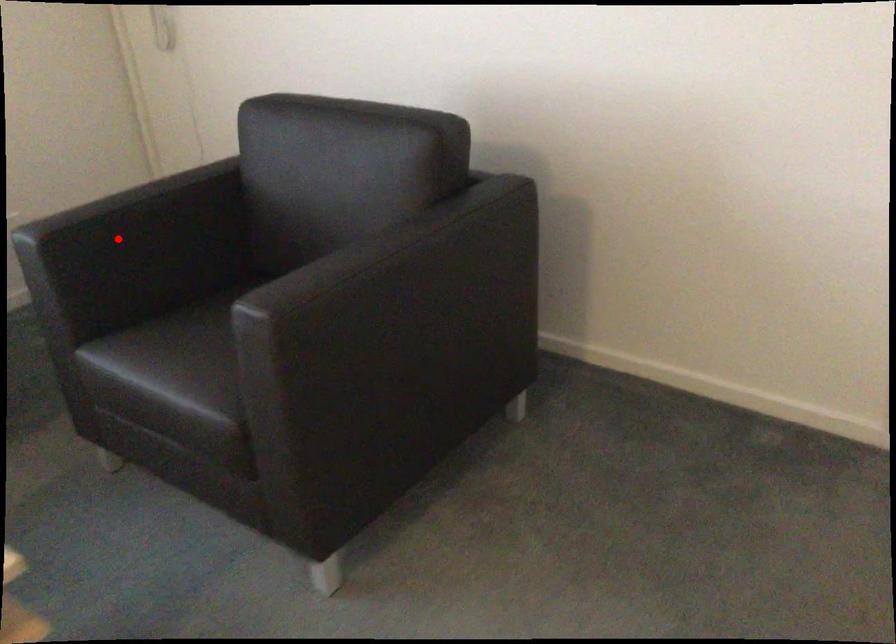
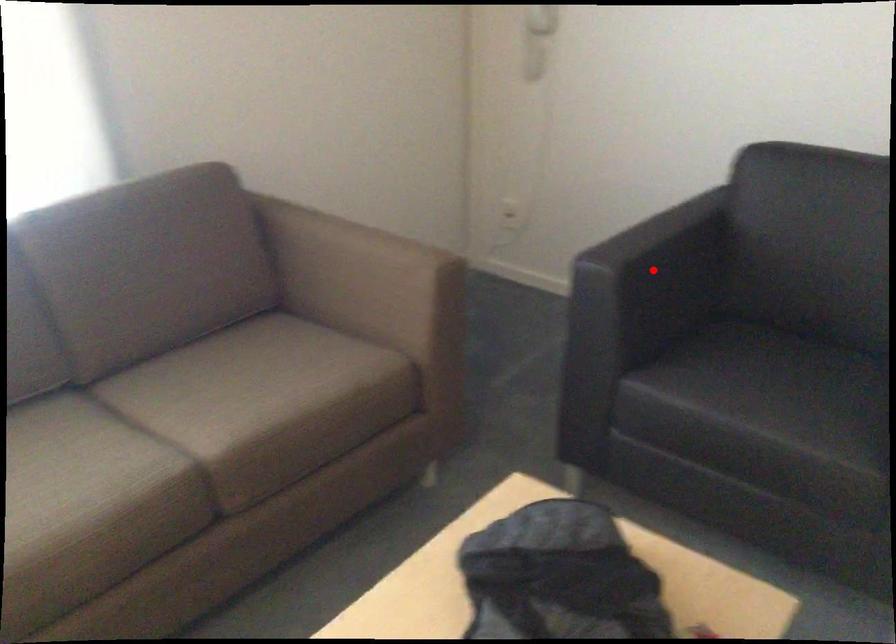
I am providing you with two images of the same scene from different viewpoints. A red point is marked on the first image and another point is marked on the second image. Is the red point in image1 aligned with the point shown in image2?

Yes